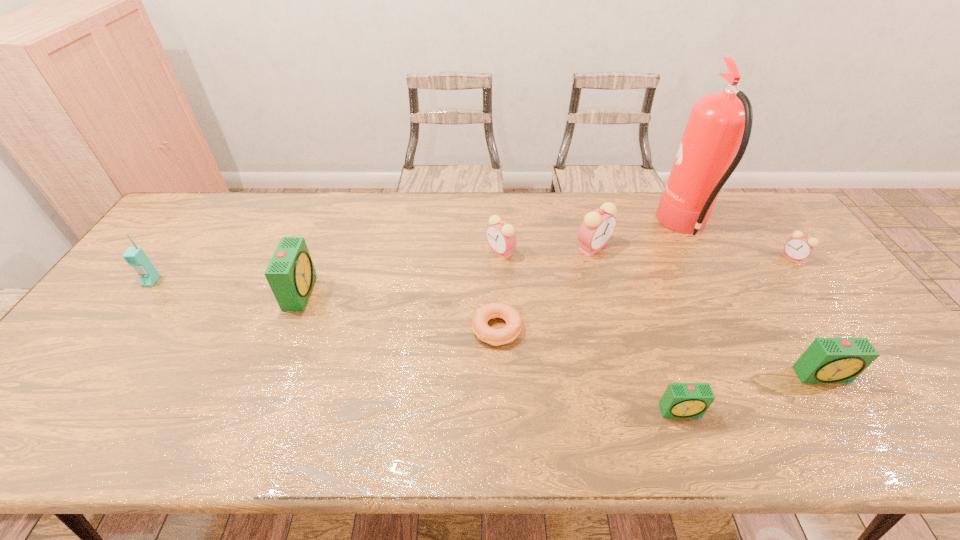
The height and width of the screenshot is (540, 960). Find the location of `alarm clock that stands as the closest to the rightmost pink alarm clock`. alarm clock that stands as the closest to the rightmost pink alarm clock is located at coordinates (827, 360).

At what (x,y) coordinates should I click in order to perform the action: click on pink alarm clock that is the closest to the leftmost green alarm clock. Please return your answer as a coordinate pair (x, y). This screenshot has height=540, width=960. Looking at the image, I should click on (501, 236).

The height and width of the screenshot is (540, 960). What are the coordinates of `pink alarm clock that is the second closest to the shortest object` in the screenshot? It's located at (598, 226).

You are a GUI agent. You are given a task and a screenshot of the screen. Output one action in this format:
    pyautogui.click(x=<x>, y=<y>)
    Task: Click on the green alarm clock that is the closest one to the smallest pink alarm clock
    The height and width of the screenshot is (540, 960).
    Given the screenshot: What is the action you would take?
    pyautogui.click(x=827, y=360)

Identify which green alarm clock is the second nearest to the biggest green alarm clock. Please provide its 2D coordinates. Your answer should be formatted as a tuple, i.e. [(x, y)], where the tuple contains the x and y coordinates of a point satisfying the conditions above.

[(827, 360)]

Where is `vacant position in the image that satisfies the following two spatial constraints: 1. on the keypad of the cellular telephone; 2. on the right side of the bagel`? This screenshot has height=540, width=960. vacant position in the image that satisfies the following two spatial constraints: 1. on the keypad of the cellular telephone; 2. on the right side of the bagel is located at coordinates (116, 329).